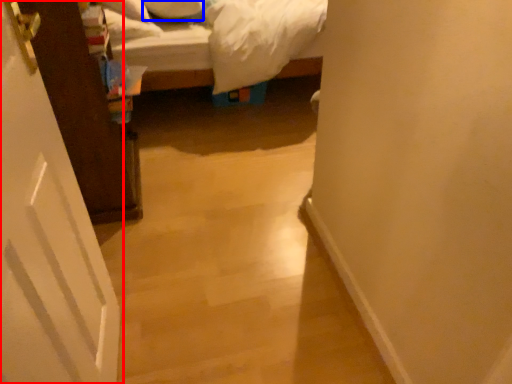
Question: Which point is closer to the camera, door (highlighted by a red box) or pillow (highlighted by a blue box)?

Choices:
 (A) door
 (B) pillow

Answer: (A)